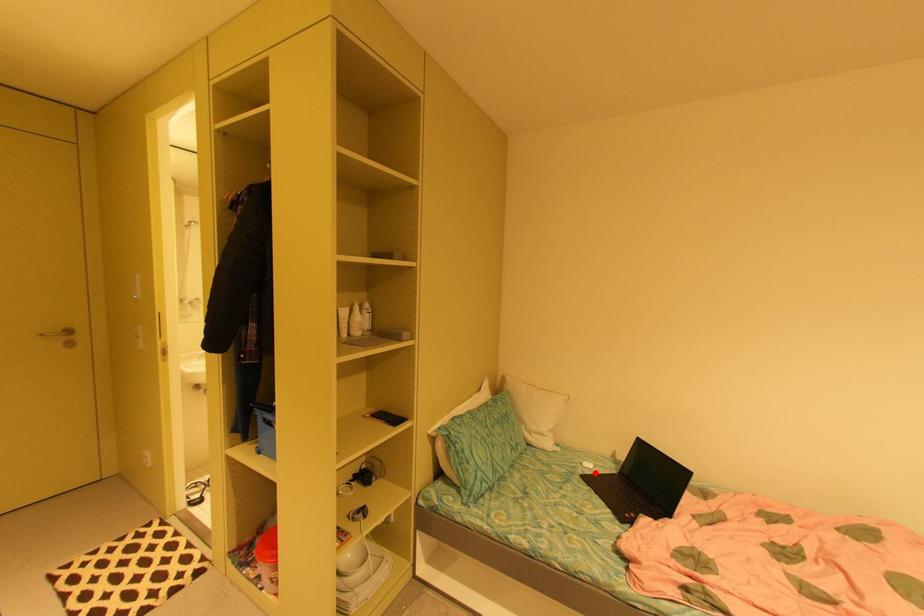
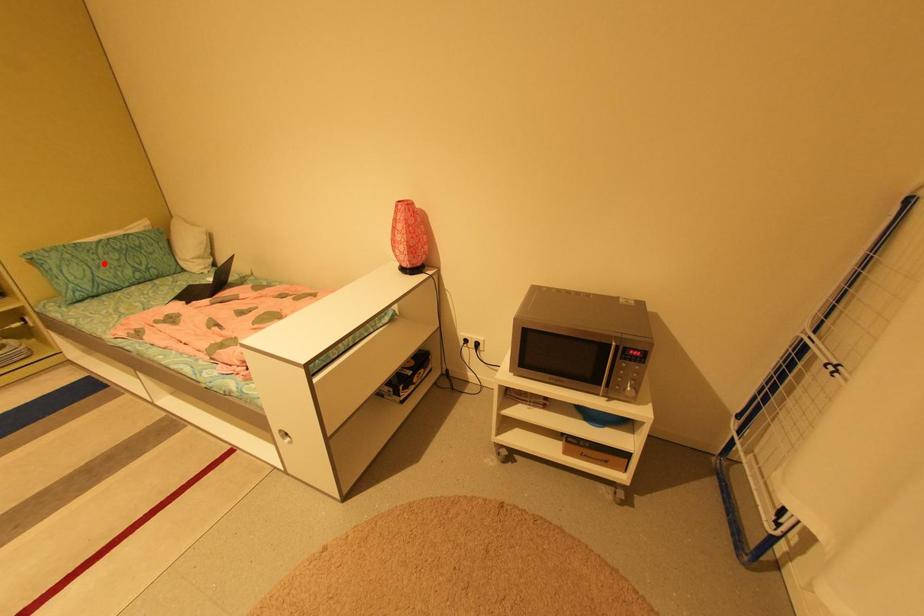
I am providing you with two images of the same scene from different viewpoints. A red point is marked on the first image and another point is marked on the second image. Do the highlighted points in image1 and image2 indicate the same real-world spot?

No